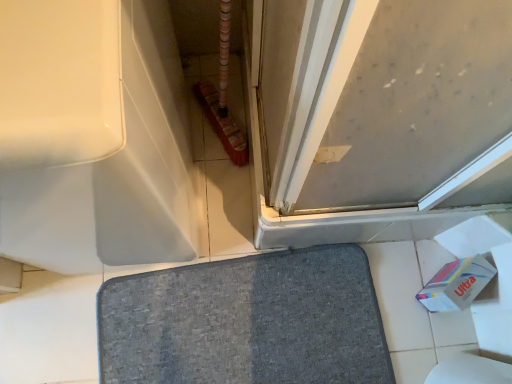
What do you see at coordinates (247, 321) in the screenshot?
I see `gray fabric bath mat at center` at bounding box center [247, 321].

The image size is (512, 384). I want to click on white cardboard toilet paper at lower right, so click(456, 284).

Locate an element on the screen. matte gray screen door at upper right is located at coordinates (380, 118).

Is gray fabric bath mat at center smaller than white cardboard toilet paper at lower right?

No, gray fabric bath mat at center is not smaller than white cardboard toilet paper at lower right.

From the image's perspective, who appears lower, gray fabric bath mat at center or white cardboard toilet paper at lower right?

gray fabric bath mat at center, from the image's perspective.

Is gray fabric bath mat at center directly adjacent to white cardboard toilet paper at lower right?

There is a gap between gray fabric bath mat at center and white cardboard toilet paper at lower right.

Is gray fabric bath mat at center inside or outside of white cardboard toilet paper at lower right?

gray fabric bath mat at center is not enclosed by white cardboard toilet paper at lower right.

Looking at this image, is the position of white glossy bathtub at upper left less distant than that of matte gray screen door at upper right?

No, it is behind matte gray screen door at upper right.

Consider the image. Considering the sizes of objects white glossy bathtub at upper left and matte gray screen door at upper right in the image provided, who is smaller, white glossy bathtub at upper left or matte gray screen door at upper right?

matte gray screen door at upper right is smaller.

Which is farther from the camera, (137, 31) or (268, 232)?

The point (268, 232) is more distant.

Is matte gray screen door at upper right surrounded by white glossy bathtub at upper left?

Actually, matte gray screen door at upper right is outside white glossy bathtub at upper left.

Does white glossy bathtub at upper left contain gray fabric bath mat at center?

Actually, gray fabric bath mat at center is outside white glossy bathtub at upper left.

From a real-world perspective, relative to gray fabric bath mat at center, is white glossy bathtub at upper left vertically above or below?

In terms of real-world spatial position, white glossy bathtub at upper left is above gray fabric bath mat at center.

Is white glossy bathtub at upper left next to gray fabric bath mat at center?

No, white glossy bathtub at upper left is not beside gray fabric bath mat at center.

From the image's perspective, is matte gray screen door at upper right above or below white cardboard toilet paper at lower right?

From the image's perspective, matte gray screen door at upper right appears above white cardboard toilet paper at lower right.

Considering the relative sizes of matte gray screen door at upper right and white cardboard toilet paper at lower right in the image provided, is matte gray screen door at upper right smaller than white cardboard toilet paper at lower right?

Incorrect, matte gray screen door at upper right is not smaller in size than white cardboard toilet paper at lower right.

Could you measure the distance between matte gray screen door at upper right and white cardboard toilet paper at lower right?

They are 18.20 inches apart.

Which is closer, [161,226] or [480,260]?

The point [161,226] is in front.

Is white glossy bathtub at upper left to the left of white cardboard toilet paper at lower right from the viewer's perspective?

Yes.

From a real-world perspective, which object stands above the other?

white glossy bathtub at upper left.

From the image's perspective, which is below, white glossy bathtub at upper left or white cardboard toilet paper at lower right?

white cardboard toilet paper at lower right is shown below in the image.

In order to click on screen door on the left of white cardboard toilet paper at lower right in this screenshot , I will do `click(380, 118)`.

Which is less distant, (468,274) or (471,18)?

Point (468,274) is positioned farther from the camera compared to point (471,18).

Is the depth of white cardboard toilet paper at lower right greater than that of matte gray screen door at upper right?

That is True.

Looking at this image, from a real-world perspective, relative to matte gray screen door at upper right, is white cardboard toilet paper at lower right vertically above or below?

white cardboard toilet paper at lower right is situated lower than matte gray screen door at upper right in the real world.

Can you see gray fabric bath mat at center touching matte gray screen door at upper right?

No, gray fabric bath mat at center is not with matte gray screen door at upper right.

From a real-world perspective, does gray fabric bath mat at center stand above matte gray screen door at upper right?

No, from a real-world perspective, gray fabric bath mat at center is not above matte gray screen door at upper right.

Does gray fabric bath mat at center have a greater width compared to matte gray screen door at upper right?

Yes.

Identify the location of toilet paper above the gray fabric bath mat at center (from a real-world perspective). Image resolution: width=512 pixels, height=384 pixels. (x=456, y=284).

You are a GUI agent. You are given a task and a screenshot of the screen. Output one action in this format:
    pyautogui.click(x=<x>, y=<y>)
    Task: Click on the bath below the matte gray screen door at upper right (from a real-world perspective)
    
    Given the screenshot: What is the action you would take?
    pyautogui.click(x=115, y=172)

Estimate the real-world distances between objects in this image. Which object is closer to white cardboard toilet paper at lower right, white glossy bathtub at upper left or matte gray screen door at upper right?

matte gray screen door at upper right.

From the image, which object appears to be farther from white cardboard toilet paper at lower right, gray fabric bath mat at center or white glossy bathtub at upper left?

white glossy bathtub at upper left is further to white cardboard toilet paper at lower right.

Looking at the image, which one is located closer to white glossy bathtub at upper left, gray fabric bath mat at center or white cardboard toilet paper at lower right?

gray fabric bath mat at center lies closer to white glossy bathtub at upper left than the other object.

Which object lies further to the anchor point white cardboard toilet paper at lower right, white glossy bathtub at upper left or gray fabric bath mat at center?

white glossy bathtub at upper left lies further to white cardboard toilet paper at lower right than the other object.

Consider the image. Based on their spatial positions, is matte gray screen door at upper right or gray fabric bath mat at center closer to white cardboard toilet paper at lower right?

gray fabric bath mat at center lies closer to white cardboard toilet paper at lower right than the other object.

When comparing their distances from gray fabric bath mat at center, does matte gray screen door at upper right or white cardboard toilet paper at lower right seem further?

matte gray screen door at upper right is positioned further to the anchor gray fabric bath mat at center.

Based on their spatial positions, is white glossy bathtub at upper left or matte gray screen door at upper right closer to gray fabric bath mat at center?

white glossy bathtub at upper left is positioned closer to the anchor gray fabric bath mat at center.

Based on their spatial positions, is gray fabric bath mat at center or white glossy bathtub at upper left further from matte gray screen door at upper right?

Based on the image, gray fabric bath mat at center appears to be further to matte gray screen door at upper right.

The image size is (512, 384). In order to click on bath between matte gray screen door at upper right and gray fabric bath mat at center along the z-axis in this screenshot , I will do `click(115, 172)`.

This screenshot has width=512, height=384. What are the coordinates of `bath mat located between white glossy bathtub at upper left and white cardboard toilet paper at lower right in the left-right direction` in the screenshot? It's located at (247, 321).

I want to click on screen door between white glossy bathtub at upper left and white cardboard toilet paper at lower right in the horizontal direction, so click(x=380, y=118).

Where is `toilet paper positioned between matte gray screen door at upper right and gray fabric bath mat at center from near to far`? The width and height of the screenshot is (512, 384). toilet paper positioned between matte gray screen door at upper right and gray fabric bath mat at center from near to far is located at coordinates (456, 284).